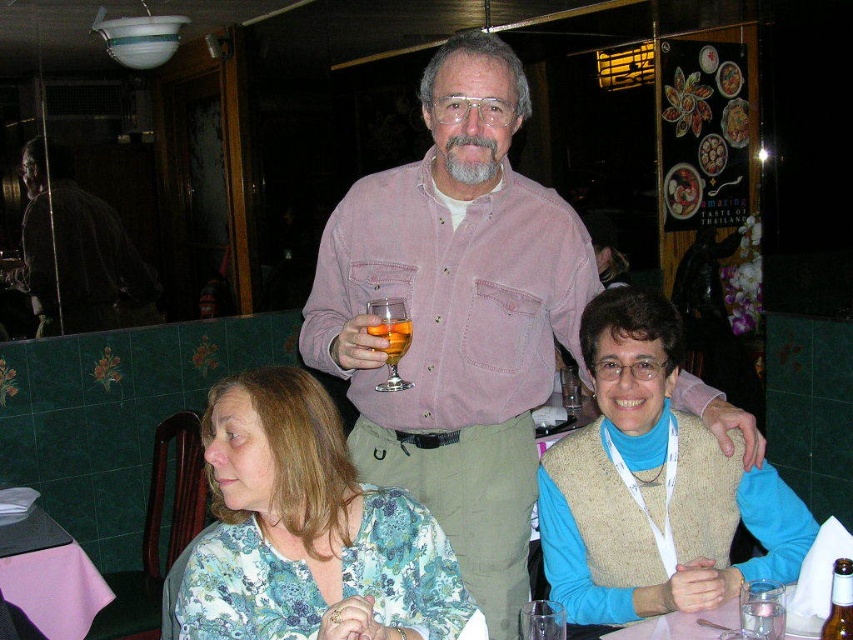
Question: Considering the real-world distances, which object is farthest from the clear glass wine glass at lower right?

Choices:
 (A) translucent glass at upper center
 (B) knitted beige vest at center
 (C) translucent glass wine glass at center

Answer: (A)

Question: Which point is closer to the camera?

Choices:
 (A) knitted beige vest at center
 (B) translucent glass wine glass at center

Answer: (B)

Question: Can you confirm if pink fabric table at lower left is smaller than brown glass bottle at lower right?

Choices:
 (A) no
 (B) yes

Answer: (A)

Question: Can you confirm if brown glass bottle at lower right is bigger than translucent glass at upper center?

Choices:
 (A) yes
 (B) no

Answer: (A)

Question: Which point is closer to the camera taking this photo?

Choices:
 (A) (502, 131)
 (B) (389, 593)
 (C) (621, 637)
 (D) (26, 552)

Answer: (B)

Question: Where is pink cotton shirt at center located in relation to transparent glass at lower center in the image?

Choices:
 (A) right
 (B) left

Answer: (B)